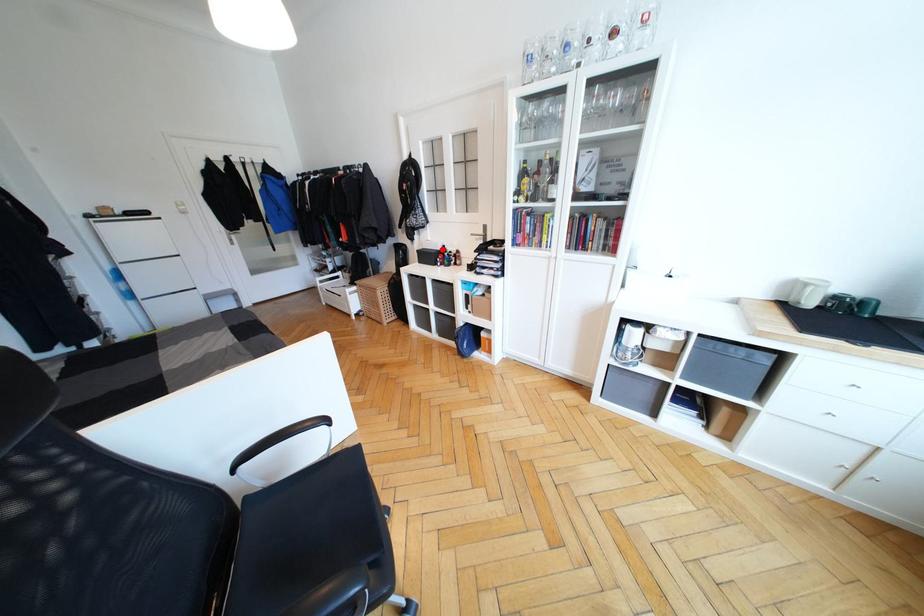
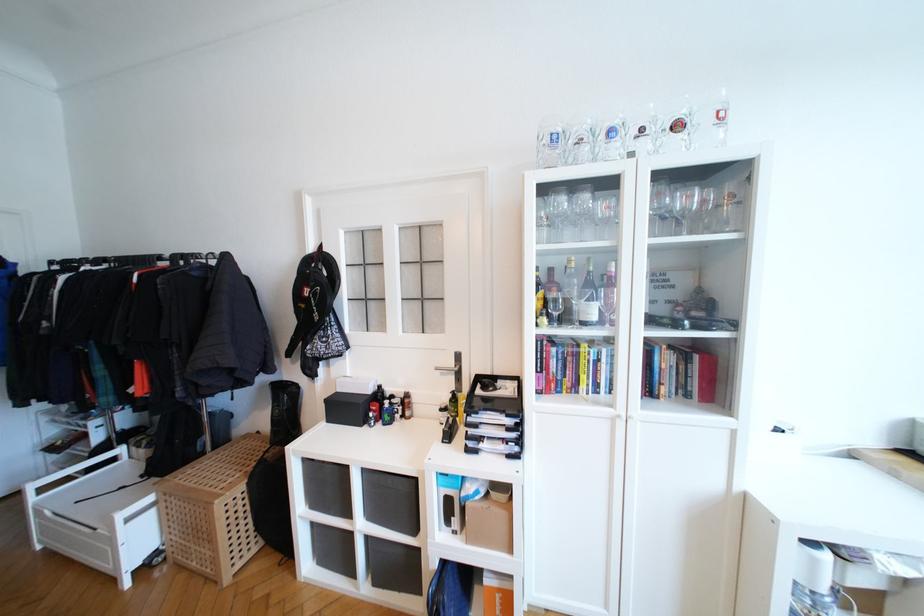
Question: I am providing you with two images of the same scene from different viewpoints. A red point is shown in image1. For the corresponding object point in image2, is it positioned nearer or farther from the camera?

Choices:
 (A) Nearer
 (B) Farther

Answer: (B)